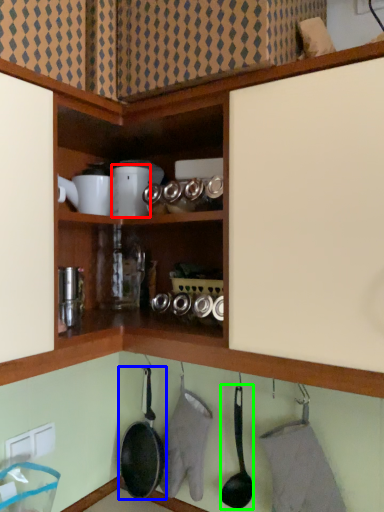
Question: Which object is positioned closest to appliance (highlighted by a red box)? Select from frying pan (highlighted by a blue box) and frying pan (highlighted by a green box).

Choices:
 (A) frying pan
 (B) frying pan

Answer: (B)